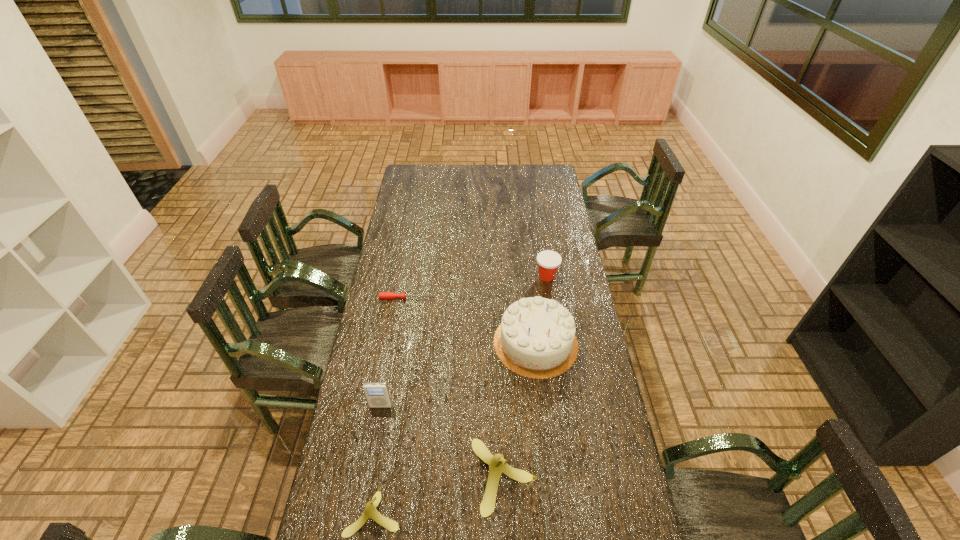
Where is `free space between the iPod and the shortest object`? free space between the iPod and the shortest object is located at coordinates (393, 352).

Find the location of a particular element. vacant space in between the third farthest object and the left banana is located at coordinates click(x=455, y=428).

At what (x,y) coordinates should I click in order to perform the action: click on object identified as the third closest to the second farthest object. Please return your answer as a coordinate pair (x, y). The height and width of the screenshot is (540, 960). Looking at the image, I should click on (377, 394).

Locate which object ranks third in proximity to the shorter banana. Please provide its 2D coordinates. Your answer should be formatted as a tuple, i.e. [(x, y)], where the tuple contains the x and y coordinates of a point satisfying the conditions above.

[(536, 338)]

You are a GUI agent. You are given a task and a screenshot of the screen. Output one action in this format:
    pyautogui.click(x=<x>, y=<y>)
    Task: Click on the vacant region that satisfies the following two spatial constraints: 1. at the tip of the fifth nearest object; 2. on the left side of the fourth nearest object
    
    Given the screenshot: What is the action you would take?
    pyautogui.click(x=397, y=343)

Identify the location of vacant space that satisfies the following two spatial constraints: 1. at the tip of the second farthest object; 2. on the back side of the birthday cake. The image size is (960, 540). (397, 343).